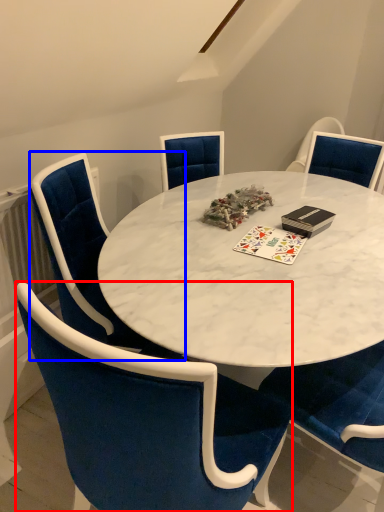
Question: Which of the following is the farthest to the observer, chair (highlighted by a red box) or chair (highlighted by a blue box)?

Choices:
 (A) chair
 (B) chair

Answer: (B)